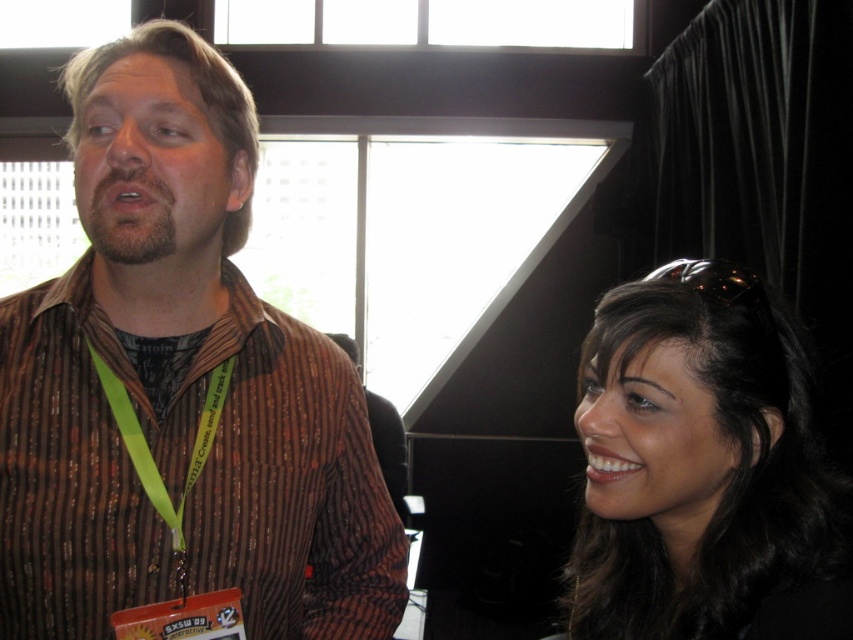
Which is more to the left, dark brown hair at upper right or brown striped shirt at center?

Positioned to the left is brown striped shirt at center.

This screenshot has height=640, width=853. Identify the location of dark brown hair at upper right. click(703, 468).

Between neon yellow fabric lanyard at left and brown striped shirt at center, which one is positioned lower?

brown striped shirt at center is below.

Find the location of a particular element. The height and width of the screenshot is (640, 853). neon yellow fabric lanyard at left is located at coordinates (152, 456).

Looking at this image, can you confirm if brown striped shirt at left is bigger than brown striped shirt at center?

No.

Is brown striped shirt at left above brown striped shirt at center?

Yes.

This screenshot has width=853, height=640. In order to click on brown striped shirt at left in this screenshot , I will do `click(178, 385)`.